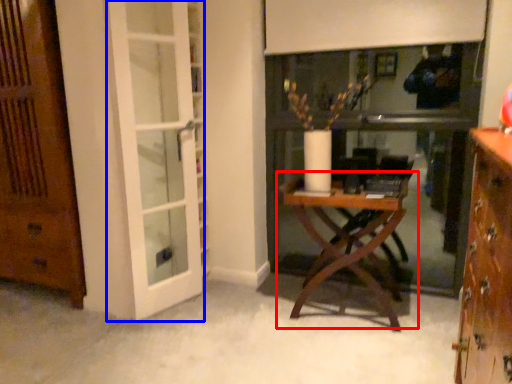
Question: Among these objects, which one is nearest to the camera, table (highlighted by a red box) or screen door (highlighted by a blue box)?

Choices:
 (A) table
 (B) screen door

Answer: (B)